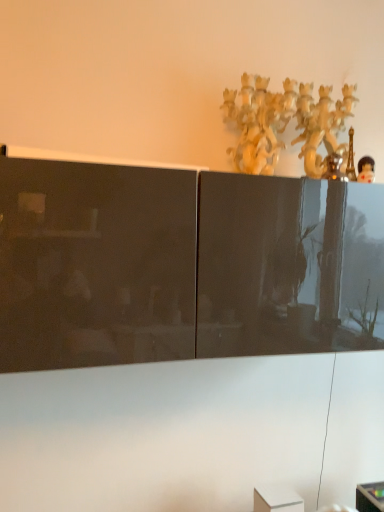
Question: Considering the positions of matte black cabinet at upper center and white glossy cabinet at upper center in the image, is matte black cabinet at upper center bigger or smaller than white glossy cabinet at upper center?

Choices:
 (A) big
 (B) small

Answer: (A)

Question: Considering their positions, is matte black cabinet at upper center located in front of or behind white glossy cabinet at upper center?

Choices:
 (A) behind
 (B) front

Answer: (A)

Question: Which object is the closest to the polished plastic figurine at upper right?

Choices:
 (A) matte black cabinet at upper center
 (B) white glossy cabinet at upper center

Answer: (B)

Question: Which object is the farthest from the matte black cabinet at upper center?

Choices:
 (A) polished plastic figurine at upper right
 (B) white glossy cabinet at upper center

Answer: (A)